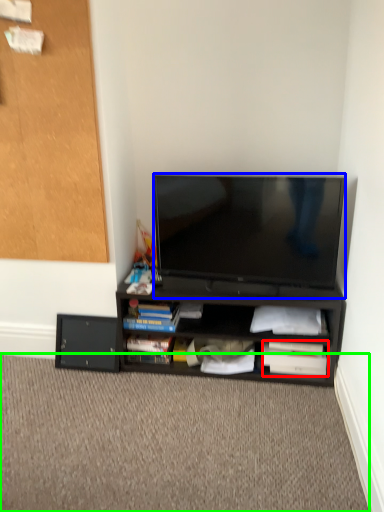
Question: Which object is positioned farthest from paperback book (highlighted by a red box)? Select from television (highlighted by a blue box) and plain (highlighted by a green box).

Choices:
 (A) television
 (B) plain

Answer: (A)